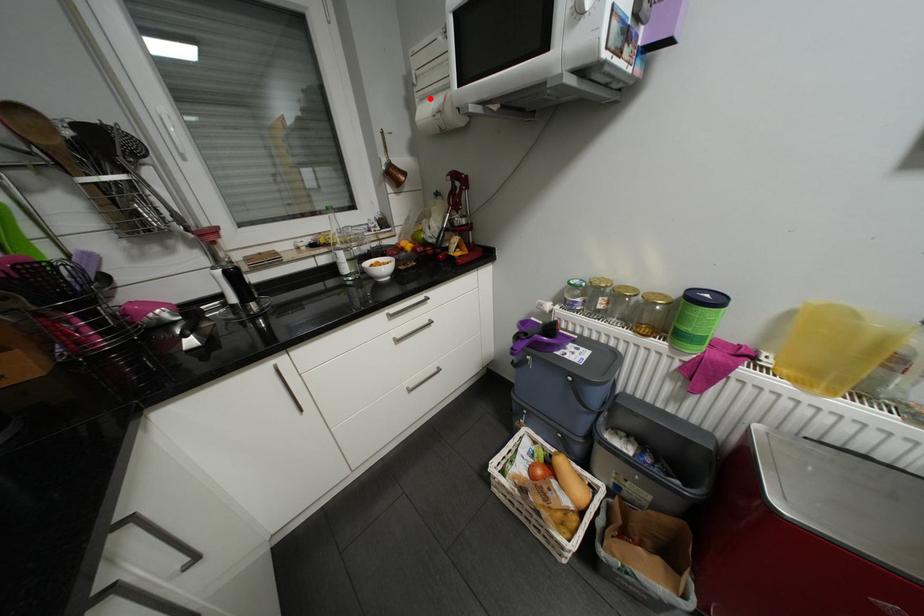
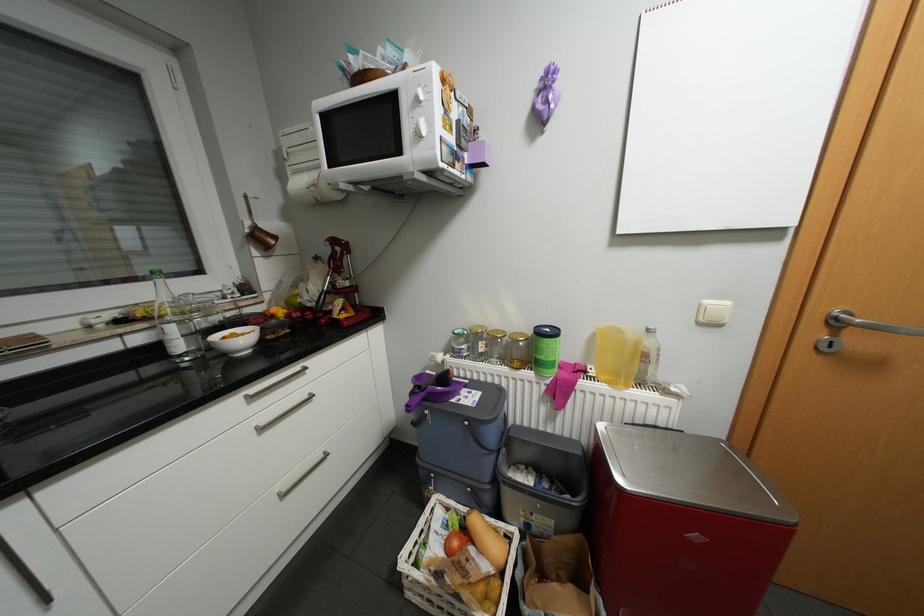
Find the pixel in the second image that matches the highlighted location in the first image.

(302, 172)